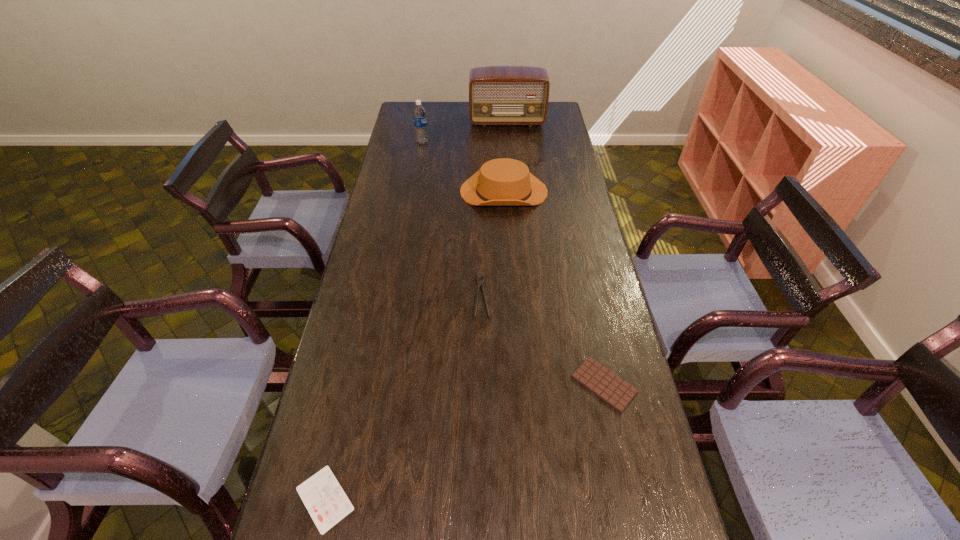
The height and width of the screenshot is (540, 960). What are the coordinates of `the nearest object` in the screenshot? It's located at pos(322,495).

The image size is (960, 540). I want to click on diary, so click(x=322, y=495).

Find the location of a particular element. The image size is (960, 540). vacant region located on the front-facing side of the radio receiver is located at coordinates (509, 146).

Locate an element on the screen. The image size is (960, 540). vacant space located on the right of the water bottle is located at coordinates (489, 143).

Find the location of a particular element. The image size is (960, 540). vacant space situated on the front-facing side of the third farthest object is located at coordinates (405, 191).

I want to click on vacant space located on the front-facing side of the third farthest object, so click(433, 191).

In order to click on free point located 0.220m on the front-facing side of the third farthest object in this screenshot , I will do `click(405, 191)`.

At what (x,y) coordinates should I click in order to perform the action: click on vacant space located 0.100m on the right of the tongs. Please return your answer as a coordinate pair (x, y). Looking at the image, I should click on (521, 296).

Identify the location of free point located on the front of the fifth tallest object. (617, 445).

I want to click on vacant region located on the back of the nearest object, so click(348, 395).